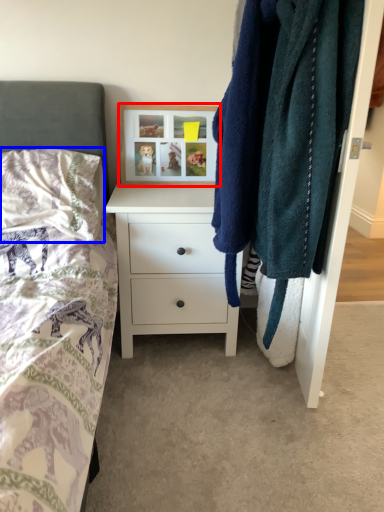
Question: Which object appears farthest to the camera in this image, picture frame (highlighted by a red box) or pillow (highlighted by a blue box)?

Choices:
 (A) picture frame
 (B) pillow

Answer: (A)